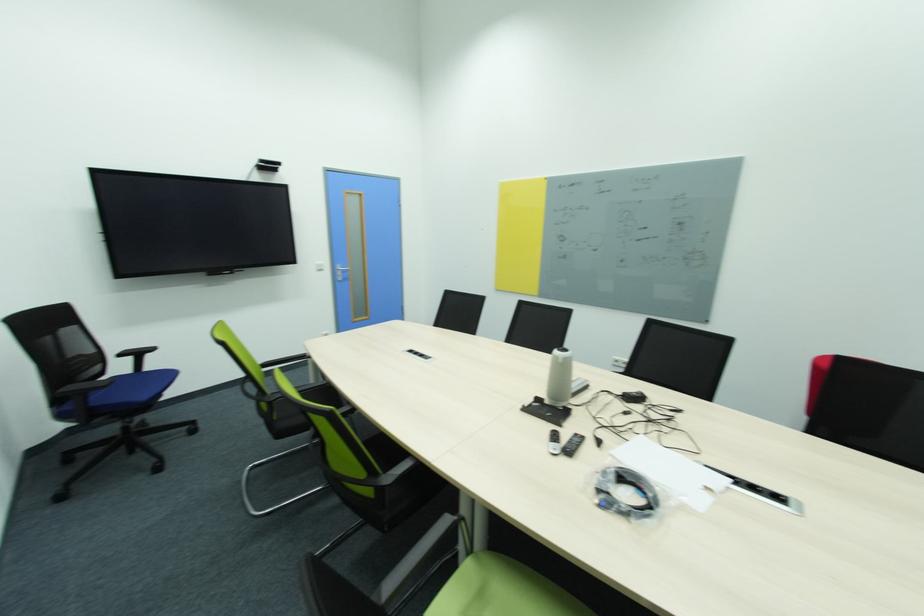
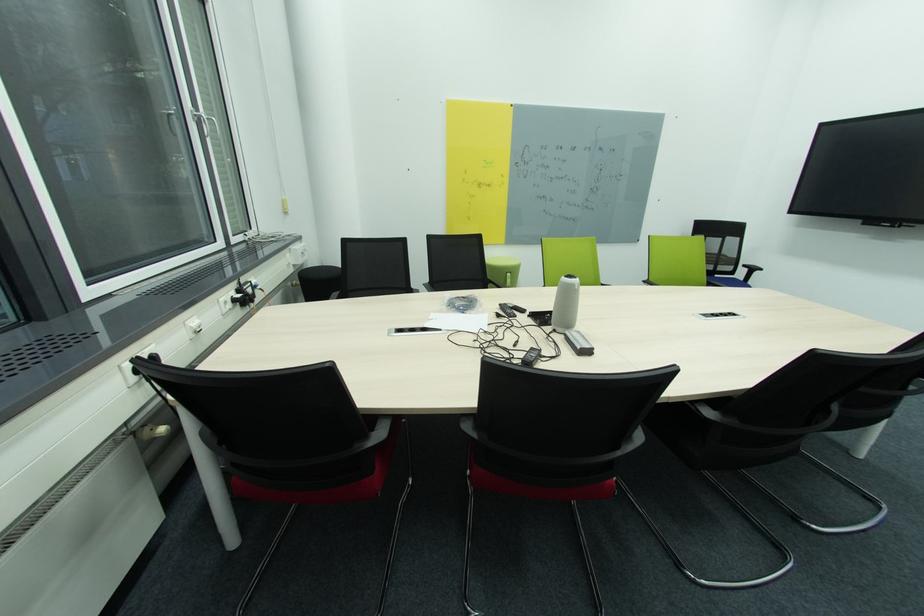
In the second image, find the point that corresponds to (687,509) in the first image.

(444, 313)